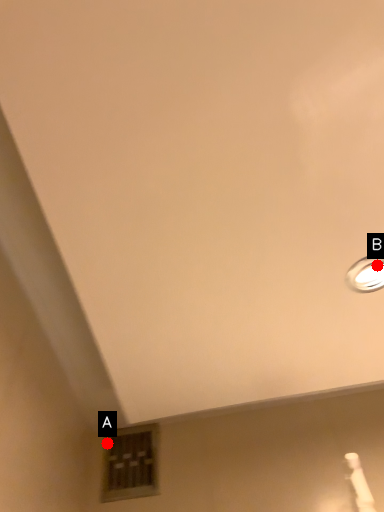
Question: Two points are circled on the image, labeled by A and B beside each circle. Which of the following is the closest to the observer?

Choices:
 (A) A is closer
 (B) B is closer

Answer: (B)